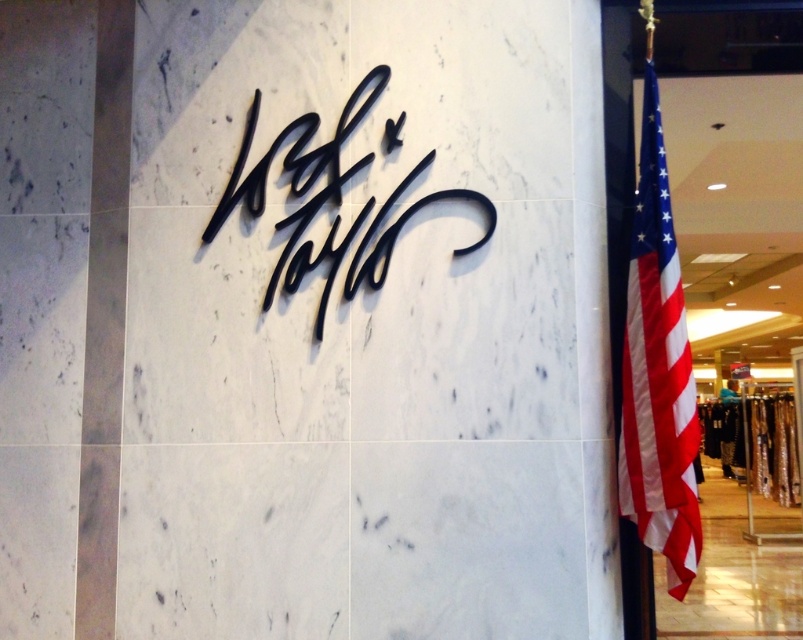
You are a store manager who wants to ensure proper display of the American flag. According to the U.S. Flag Code, the American flag should be displayed in a prominent position and should not be smaller than other signs. Given the current setup, does the american flag at right meet this requirement compared to the black metal sign at center?

The american flag at right has a larger size compared to the black metal sign at center, so it meets the requirement as it is not smaller than the other sign.

You are a customer entering the store and see the american flag at right and the black metal sign at center. Which object is positioned lower in the store?

Result: The american flag at right is located below the black metal sign at center, so it is positioned lower in the store.